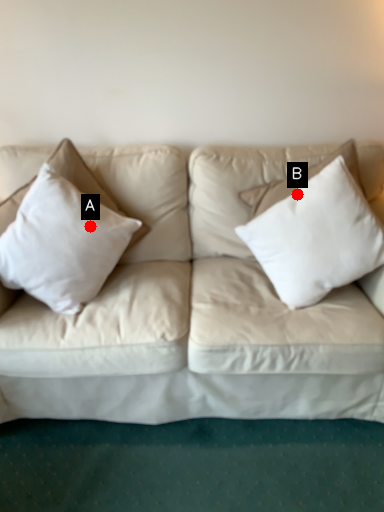
Question: Two points are circled on the image, labeled by A and B beside each circle. Which of the following is the closest to the observer?

Choices:
 (A) A is closer
 (B) B is closer

Answer: (B)